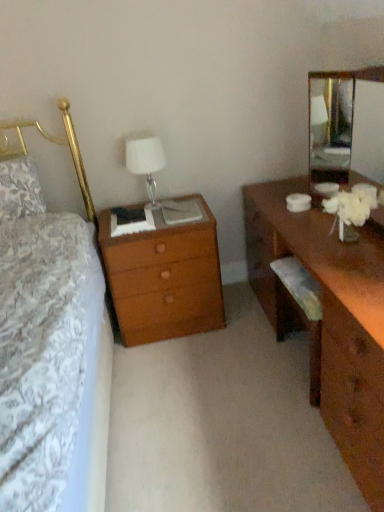
Locate an element on the screen. The width and height of the screenshot is (384, 512). free point above wooden nightstand at left (from a real-world perspective) is located at coordinates click(140, 212).